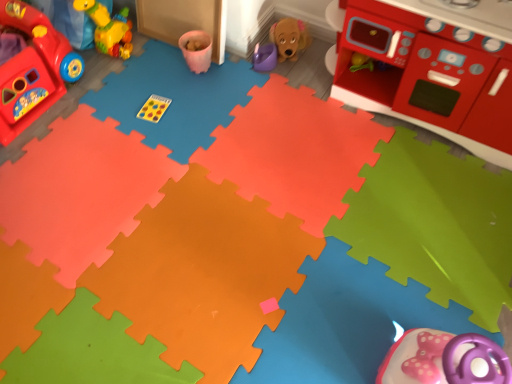
Question: Can you confirm if rubberized red play kitchen at left, the 1th toy viewed from the left, is taller than smooth plastic toy stove at upper right?

Choices:
 (A) yes
 (B) no

Answer: (B)

Question: Are rubberized red play kitchen at left, the 3th toy positioned from the right, and smooth plastic toy stove at upper right beside each other?

Choices:
 (A) no
 (B) yes

Answer: (A)

Question: Can we say rubberized red play kitchen at left, the 3th toy positioned from the right, lies outside smooth plastic toy stove at upper right?

Choices:
 (A) no
 (B) yes

Answer: (B)

Question: Is rubberized red play kitchen at left, the 1th toy viewed from the left, positioned behind smooth plastic toy stove at upper right?

Choices:
 (A) yes
 (B) no

Answer: (A)

Question: Could you tell me if rubberized red play kitchen at left, the 3th toy positioned from the right, is facing smooth plastic toy stove at upper right?

Choices:
 (A) yes
 (B) no

Answer: (A)

Question: From a real-world perspective, relative to smooth plastic toy stove at upper right, is purple plastic watering can at center, which is the third toy in left-to-right order, vertically above or below?

Choices:
 (A) above
 (B) below

Answer: (B)

Question: In the image, is purple plastic watering can at center, which is the third toy in left-to-right order, positioned in front of or behind smooth plastic toy stove at upper right?

Choices:
 (A) front
 (B) behind

Answer: (B)

Question: From the image's perspective, is purple plastic watering can at center, which is the third toy in left-to-right order, above or below smooth plastic toy stove at upper right?

Choices:
 (A) above
 (B) below

Answer: (A)

Question: Considering the positions of point (264, 62) and point (502, 61), is point (264, 62) closer or farther from the camera than point (502, 61)?

Choices:
 (A) farther
 (B) closer

Answer: (A)

Question: From a real-world perspective, is rubberized red play kitchen at left, the 3th toy positioned from the right, above or below rubber duck at upper left, which is counted as the second toy, starting from the left?

Choices:
 (A) above
 (B) below

Answer: (B)

Question: In the image, is rubberized red play kitchen at left, the 1th toy viewed from the left, positioned in front of or behind rubber duck at upper left, which is the second toy in right-to-left order?

Choices:
 (A) front
 (B) behind

Answer: (A)

Question: In terms of width, does rubberized red play kitchen at left, the 1th toy viewed from the left, look wider or thinner when compared to rubber duck at upper left, which is counted as the second toy, starting from the left?

Choices:
 (A) thin
 (B) wide

Answer: (B)

Question: Is rubberized red play kitchen at left, the 1th toy viewed from the left, inside the boundaries of rubber duck at upper left, which is counted as the second toy, starting from the left, or outside?

Choices:
 (A) outside
 (B) inside

Answer: (A)

Question: Considering the positions of point (261, 69) and point (100, 41), is point (261, 69) closer or farther from the camera than point (100, 41)?

Choices:
 (A) farther
 (B) closer

Answer: (B)

Question: Looking at the image, does purple plastic watering can at center, which is the third toy in left-to-right order, seem bigger or smaller compared to rubber duck at upper left, which is the second toy in right-to-left order?

Choices:
 (A) big
 (B) small

Answer: (B)